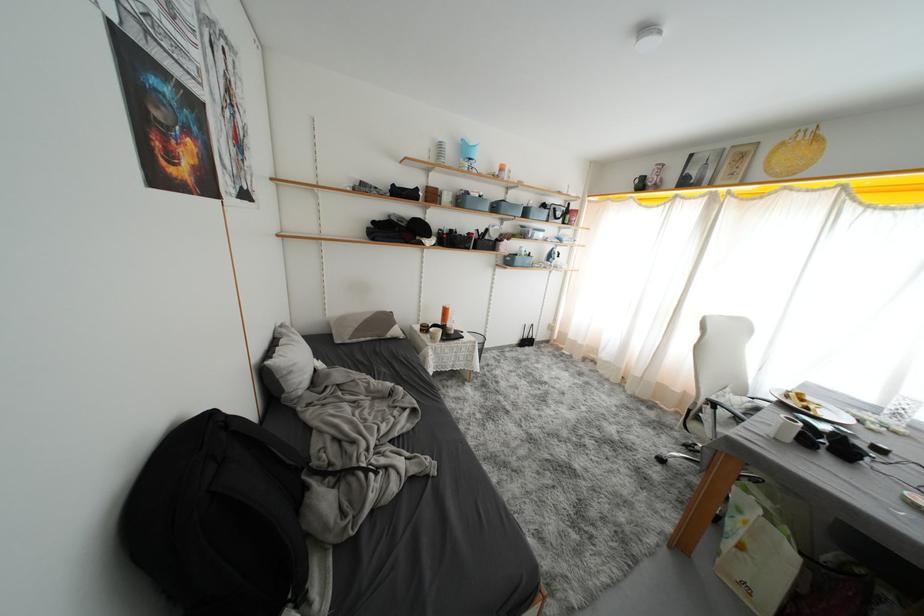
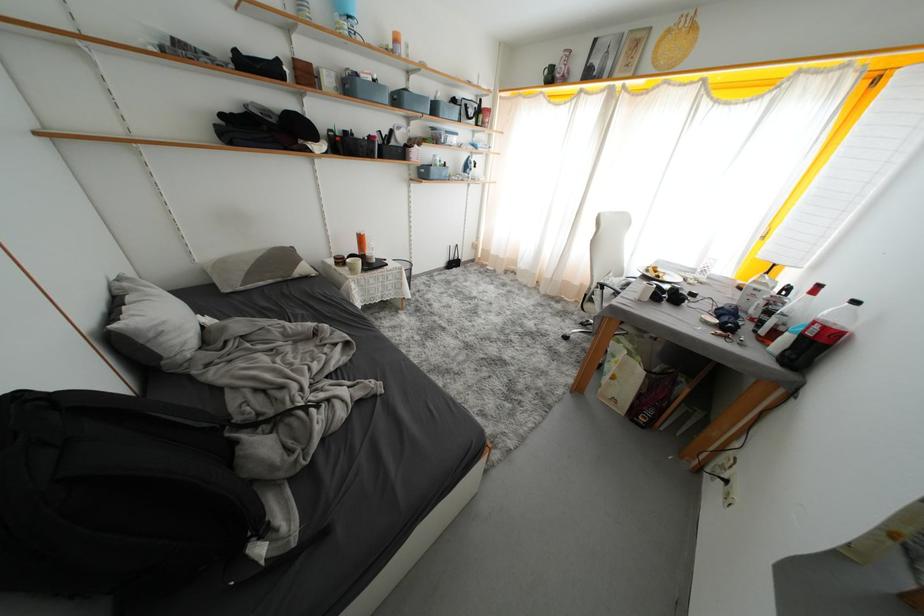
Question: The images are taken continuously from a first-person perspective. In which direction are you moving?

Choices:
 (A) Left
 (B) Right
 (C) Forward
 (D) Backward

Answer: (C)